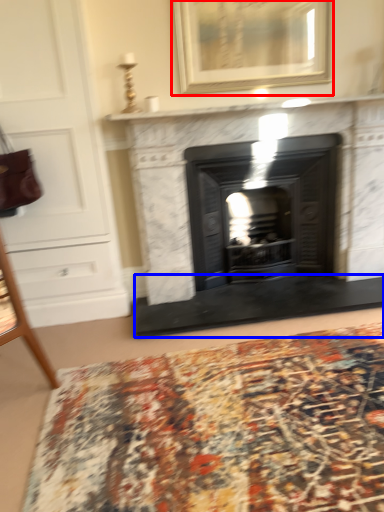
Question: Which point is closer to the camera, picture frame (highlighted by a red box) or doormat (highlighted by a blue box)?

Choices:
 (A) picture frame
 (B) doormat

Answer: (A)